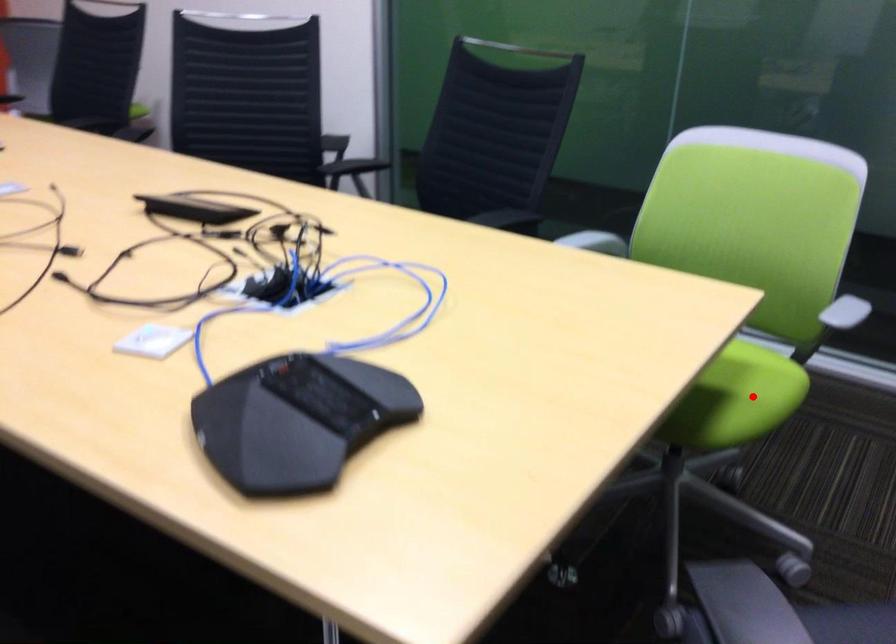
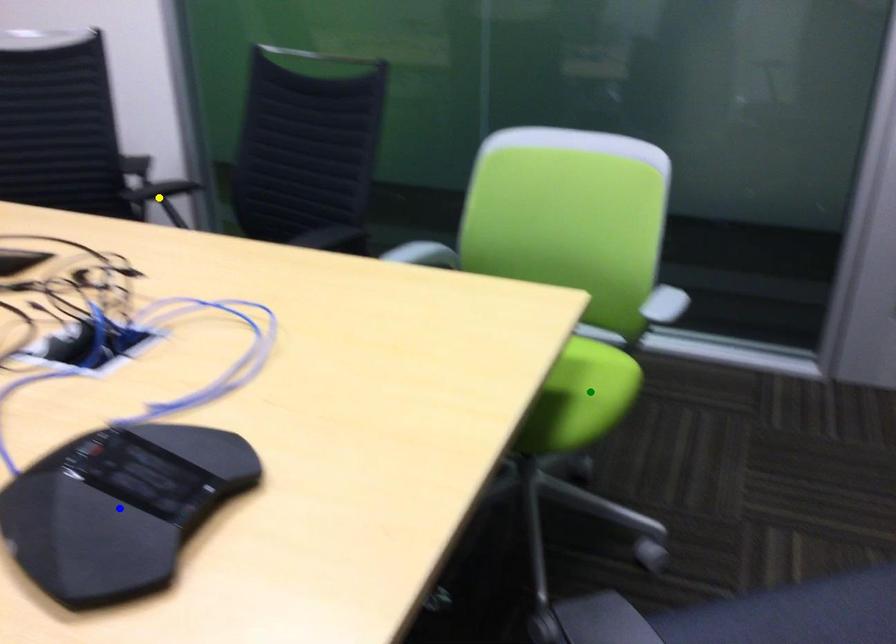
Question: I am providing you with two images of the same scene from different viewpoints. A red point is marked on the first image. You are given multiple points on the second image. Can you choose the point in image 2 that corresponds to the point in image 1?

Choices:
 (A) yellow point
 (B) green point
 (C) blue point

Answer: (B)